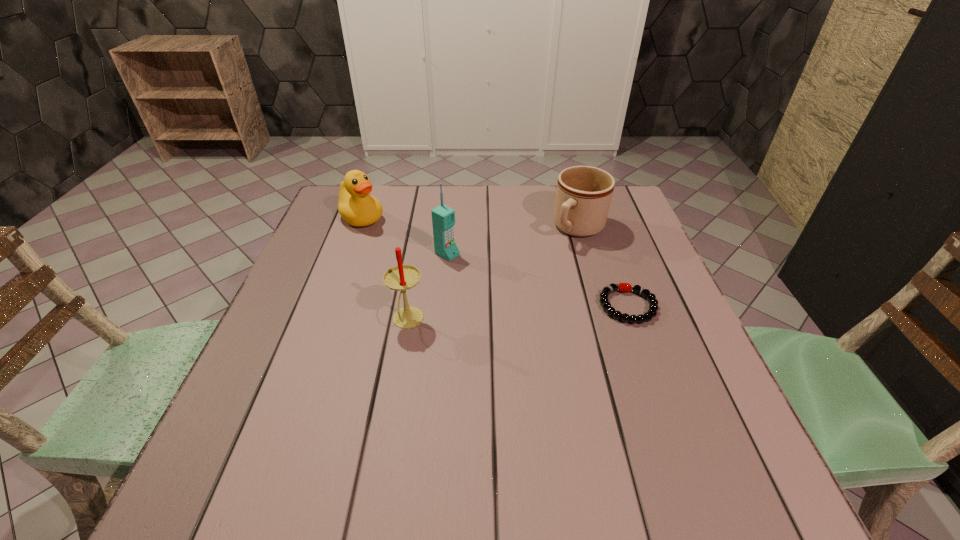
This screenshot has height=540, width=960. In order to click on vacant space located on the side of the mug with the handle in this screenshot , I will do `click(553, 259)`.

I want to click on free space located on the side of the mug with the handle, so click(x=495, y=317).

Where is `vacant space positioned 0.180m on the side of the mug with the handle`? This screenshot has width=960, height=540. vacant space positioned 0.180m on the side of the mug with the handle is located at coordinates (533, 279).

This screenshot has width=960, height=540. I want to click on vacant space located 0.310m on the keypad of the third object from right to left, so click(558, 316).

This screenshot has width=960, height=540. Identify the location of free point located 0.290m on the keypad of the third object from right to left. (550, 312).

Where is `free space located 0.060m on the keypad of the third object from right to left`? The width and height of the screenshot is (960, 540). free space located 0.060m on the keypad of the third object from right to left is located at coordinates (474, 269).

Where is `duck located at the far edge`? The height and width of the screenshot is (540, 960). duck located at the far edge is located at coordinates (356, 206).

This screenshot has width=960, height=540. Find the location of `mug at the far edge`. mug at the far edge is located at coordinates (583, 195).

Where is `object at the left edge`? object at the left edge is located at coordinates (356, 206).

Identify the location of bracelet present at the right edge. The image size is (960, 540). (622, 287).